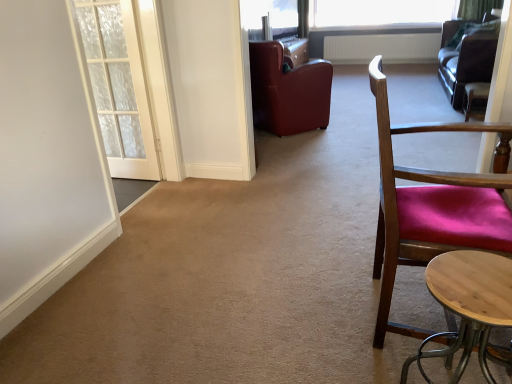
Image resolution: width=512 pixels, height=384 pixels. Find the location of `unoccupied space behind light wood round table at lower right`. unoccupied space behind light wood round table at lower right is located at coordinates (401, 337).